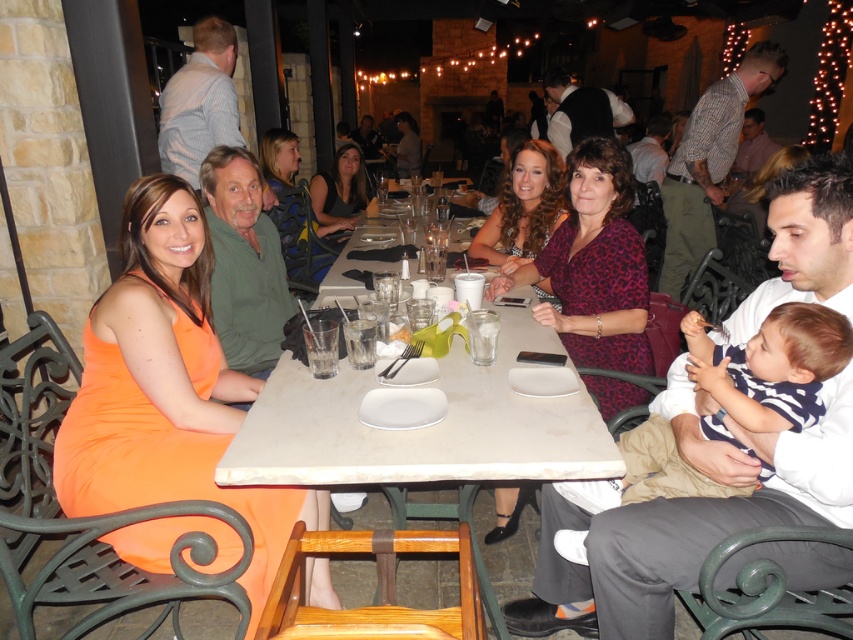
You are standing at the camera position and want to walk towards the two points marked in the image. Which point would you reach first, point (326,493) or point (292,150)?

Point (326,493) is closer to the camera than point (292,150), so you would reach point (326,493) first.